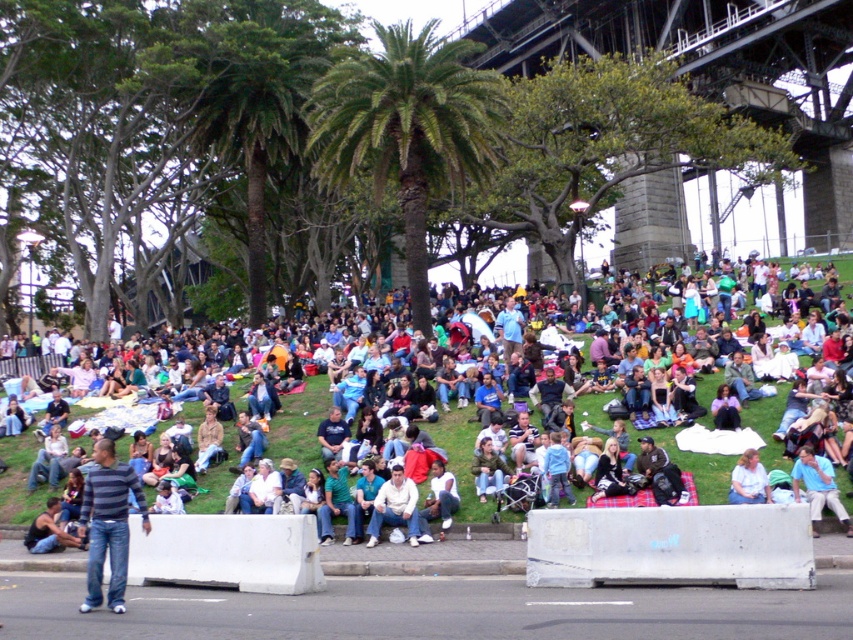
You are standing in the park and want to take a photo of the metallic steel bridge at upper center without the green leafy palm tree at center blocking the view. Is the palm tree in front of or behind the bridge?

The green leafy palm tree at center is behind the metallic steel bridge at upper center, so it won not block the view of the bridge.

You are standing in the park and see the striped shirt at lower left and the light beige shirt at center. Which person is closer to you?

The striped shirt at lower left is closer to the viewer than the light beige shirt at center.